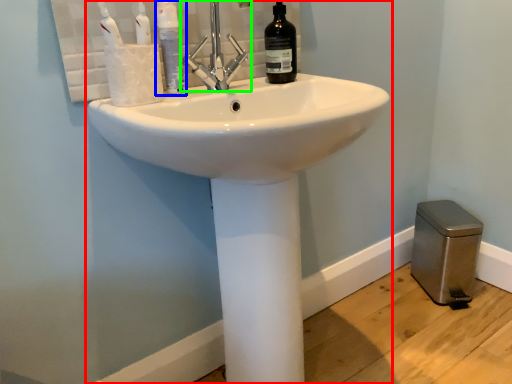
Question: Which is farther away from sink (highlighted by a red box)? mouthwash (highlighted by a blue box) or tap (highlighted by a green box)?

Choices:
 (A) mouthwash
 (B) tap

Answer: (A)